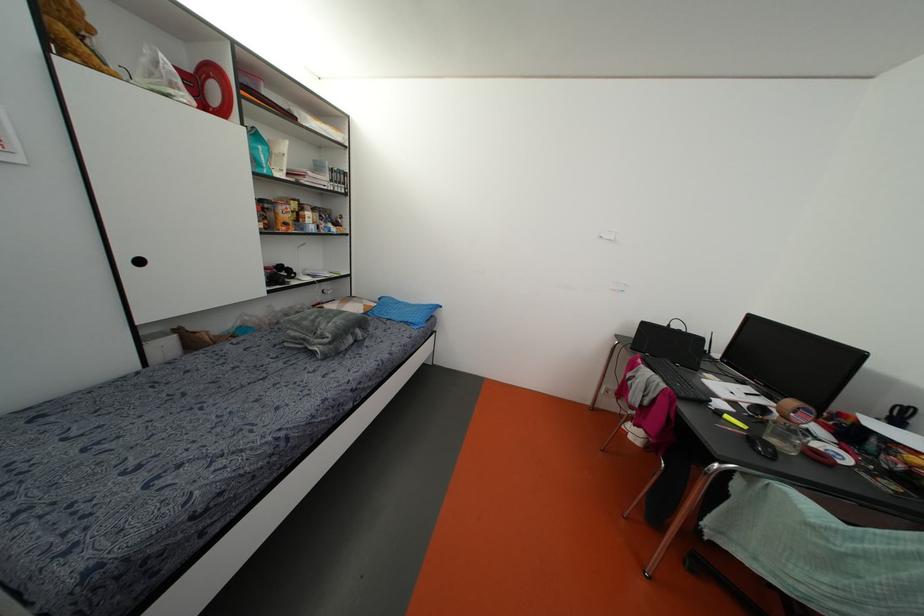
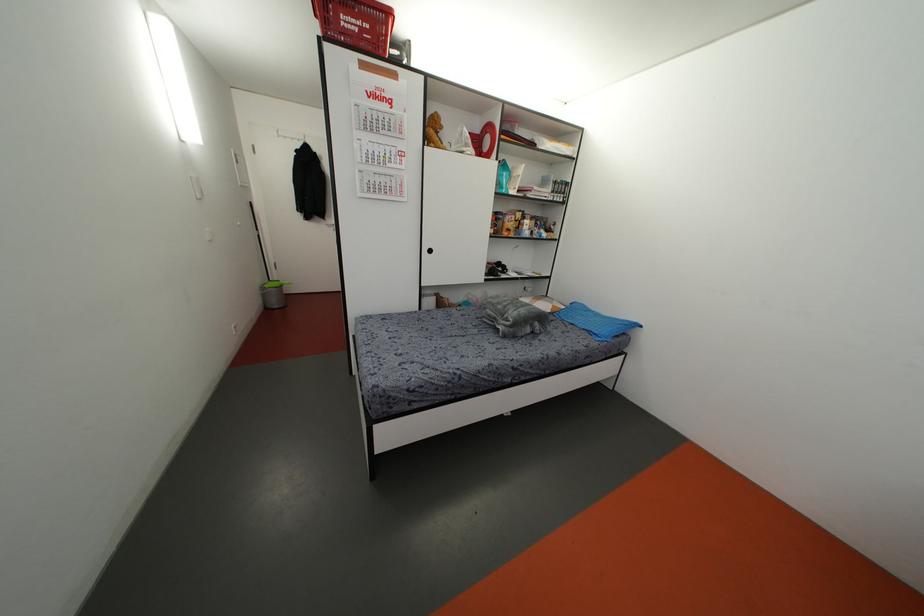
The point at (332, 407) is marked in the first image. Where is the corresponding point in the second image?

(493, 373)